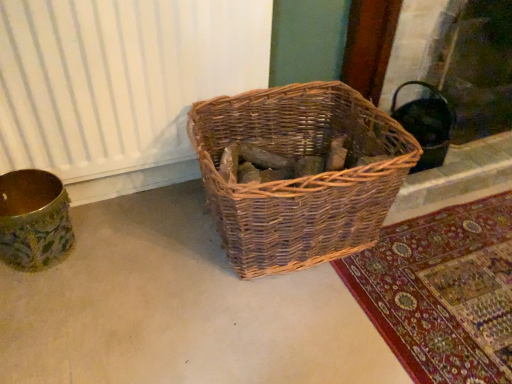
Question: Should I look upward or downward to see natural woven basket at center?

Choices:
 (A) down
 (B) up

Answer: (B)

Question: Is natural woven basket at center beside white textured radiator at left?

Choices:
 (A) no
 (B) yes

Answer: (A)

Question: From the image's perspective, would you say natural woven basket at center is shown under white textured radiator at left?

Choices:
 (A) no
 (B) yes

Answer: (B)

Question: Could white textured radiator at left be considered to be inside natural woven basket at center?

Choices:
 (A) no
 (B) yes

Answer: (A)

Question: Is natural woven basket at center positioned far away from white textured radiator at left?

Choices:
 (A) yes
 (B) no

Answer: (B)

Question: Is natural woven basket at center positioned behind white textured radiator at left?

Choices:
 (A) yes
 (B) no

Answer: (B)

Question: Is natural woven basket at center located outside white textured radiator at left?

Choices:
 (A) no
 (B) yes

Answer: (B)

Question: Does white textured radiator at left have a greater height compared to gold textured vase at left?

Choices:
 (A) yes
 (B) no

Answer: (A)

Question: Does white textured radiator at left come in front of gold textured vase at left?

Choices:
 (A) no
 (B) yes

Answer: (B)

Question: Can you see white textured radiator at left touching gold textured vase at left?

Choices:
 (A) yes
 (B) no

Answer: (B)

Question: Is white textured radiator at left oriented away from gold textured vase at left?

Choices:
 (A) no
 (B) yes

Answer: (A)

Question: Is white textured radiator at left bigger than gold textured vase at left?

Choices:
 (A) yes
 (B) no

Answer: (A)

Question: From the image's perspective, is white textured radiator at left located beneath gold textured vase at left?

Choices:
 (A) no
 (B) yes

Answer: (A)

Question: Is black matte fireplace at upper right oriented away from natural woven basket at center?

Choices:
 (A) yes
 (B) no

Answer: (B)